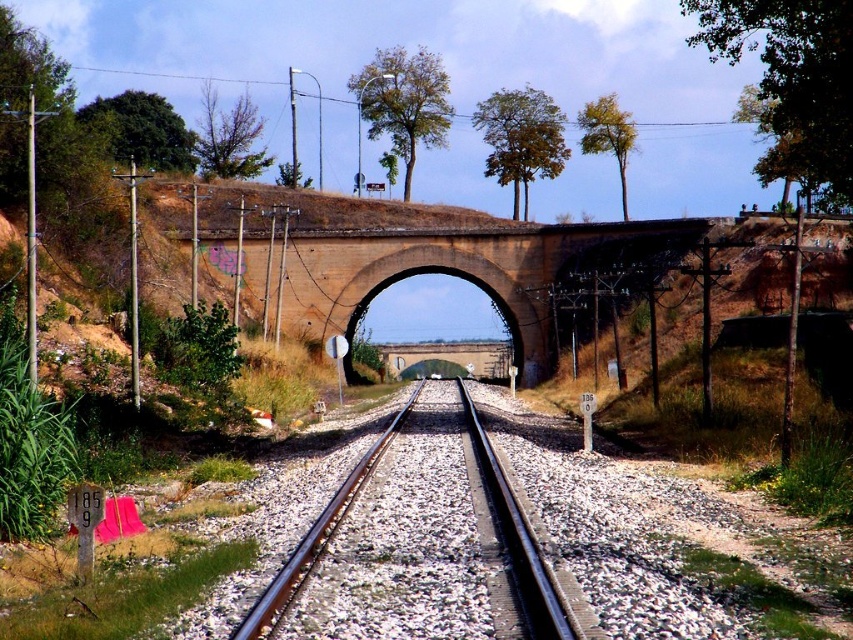
Can you confirm if brown brick bridge at center is shorter than black metal train track at center?

Incorrect, brown brick bridge at center's height does not fall short of black metal train track at center's.

Can you confirm if brown brick bridge at center is wider than black metal train track at center?

Yes, brown brick bridge at center is wider than black metal train track at center.

Find the location of a particular element. This screenshot has height=640, width=853. brown brick bridge at center is located at coordinates (437, 269).

I want to click on brown brick bridge at center, so click(x=437, y=269).